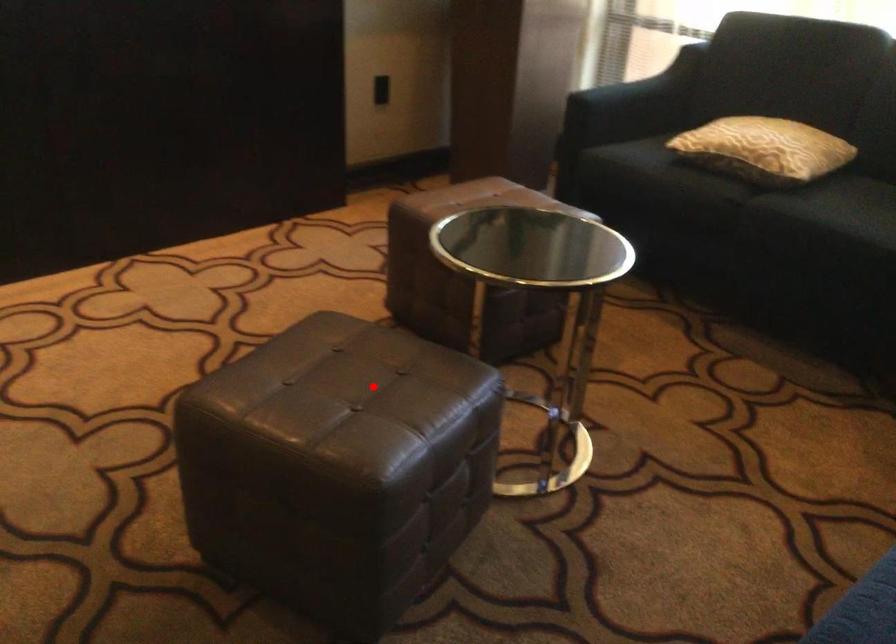
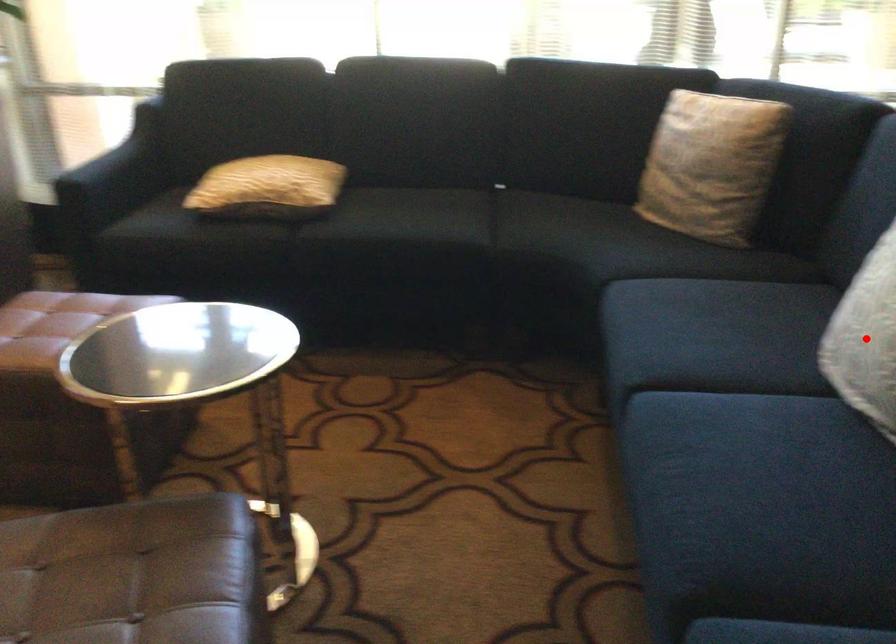
I am providing you with two images of the same scene from different viewpoints. A red point is marked on the first image and another point is marked on the second image. Do the highlighted points in image1 and image2 indicate the same real-world spot?

No